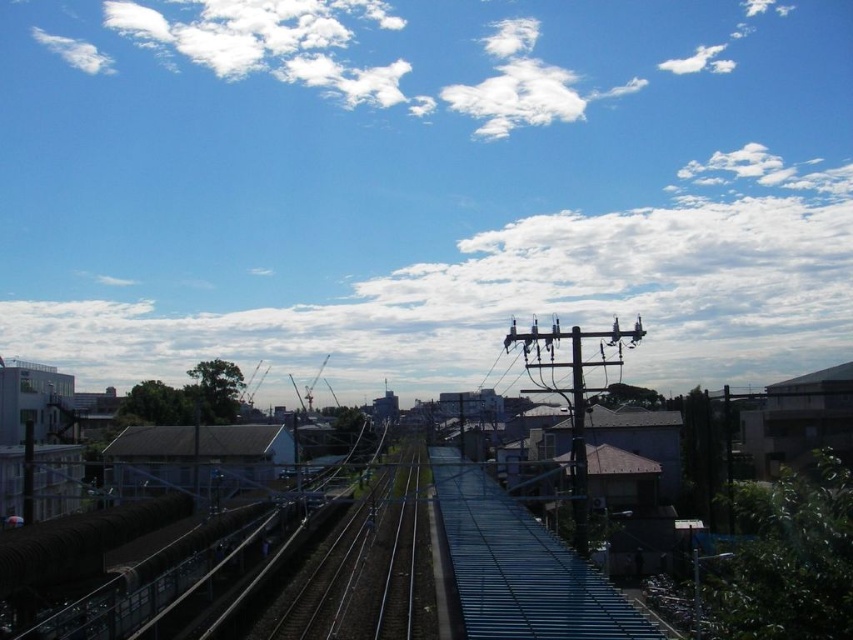
Question: Which object appears closest to the camera in this image?

Choices:
 (A) metallic blue train track at center
 (B) white fluffy cloud at upper center
 (C) metallic gray power line at center
 (D) white fluffy cloud at upper left

Answer: (C)

Question: Is white fluffy cloud at upper left closer to the viewer compared to white fluffy cloud at upper center?

Choices:
 (A) yes
 (B) no

Answer: (B)

Question: Estimate the real-world distances between objects in this image. Which object is closer to the white fluffy cloud at upper center?

Choices:
 (A) metallic blue train track at center
 (B) metallic gray power line at center
 (C) white fluffy cloud at upper left

Answer: (C)

Question: Can you confirm if metallic blue train track at center is positioned below metallic gray power line at center?

Choices:
 (A) no
 (B) yes

Answer: (B)

Question: Which point is farther to the camera?

Choices:
 (A) (51, 45)
 (B) (692, 65)
 (C) (618, 349)
 (D) (422, 577)

Answer: (A)

Question: Does metallic blue train track at center come behind white fluffy cloud at upper center?

Choices:
 (A) no
 (B) yes

Answer: (A)